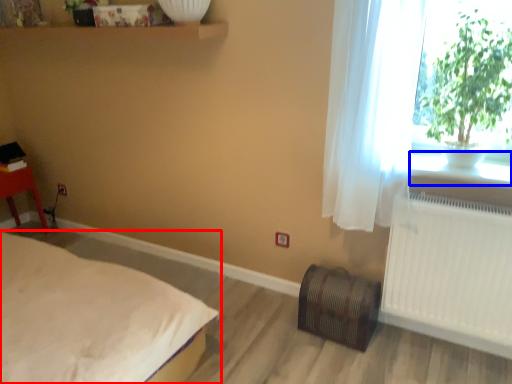
Question: Among these objects, which one is farthest to the camera, bed (highlighted by a red box) or window sill (highlighted by a blue box)?

Choices:
 (A) bed
 (B) window sill

Answer: (B)